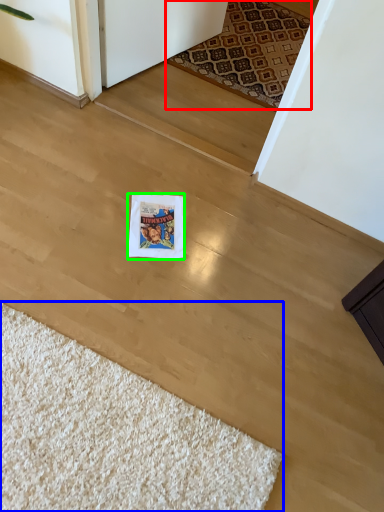
Question: Which object is positioned closest to mat (highlighted by a red box)? Select from doormat (highlighted by a blue box) and postcard (highlighted by a green box).

Choices:
 (A) doormat
 (B) postcard

Answer: (B)